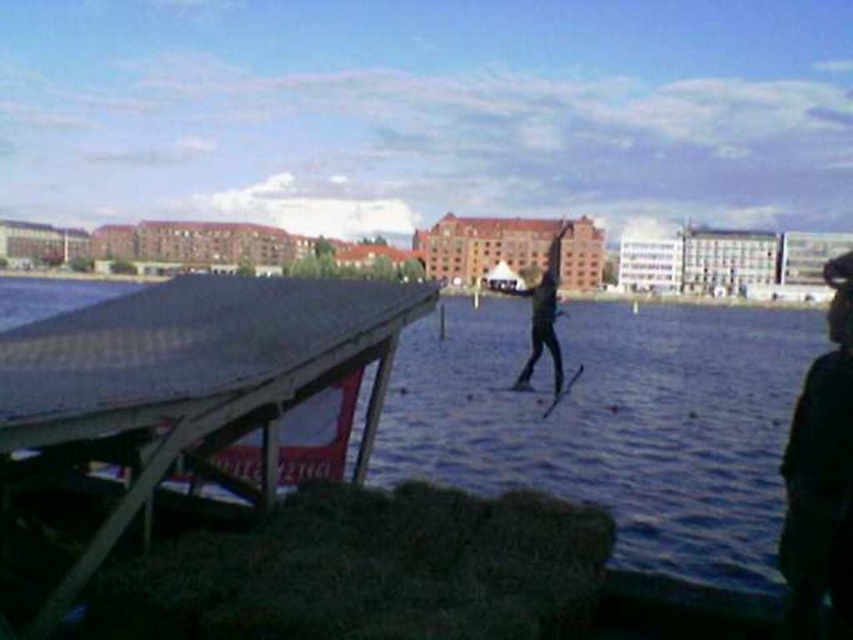
You are a photographer trying to capture the perfect shot of the water skier. You notice two skis attached to the person in the image. Which of the two skis, the black matte skis at center or the shiny black ski at center, is positioned to the right side of the other?

The black matte skis at center are positioned to the right of the shiny black ski at center.